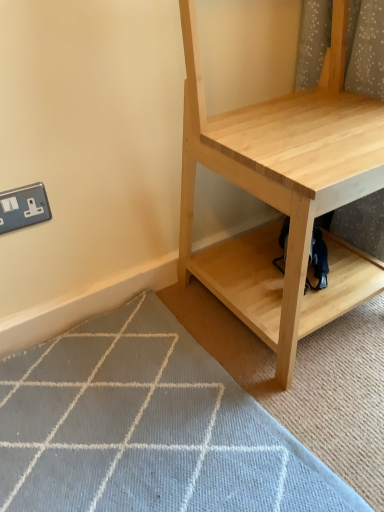
Question: Relative to light gray woven mat at lower left, is natural wood shelf at center in front or behind?

Choices:
 (A) behind
 (B) front

Answer: (B)

Question: Based on their sizes in the image, would you say natural wood shelf at center is bigger or smaller than light gray woven mat at lower left?

Choices:
 (A) big
 (B) small

Answer: (A)

Question: Considering the real-world distances, which object is farthest from the dark blue fabric swivel chair at lower center?

Choices:
 (A) natural wood shelf at center
 (B) light gray woven mat at lower left
 (C) silver metallic electric outlet at lower left

Answer: (C)

Question: Estimate the real-world distances between objects in this image. Which object is closer to the dark blue fabric swivel chair at lower center?

Choices:
 (A) silver metallic electric outlet at lower left
 (B) light gray woven mat at lower left
 (C) natural wood shelf at center

Answer: (C)